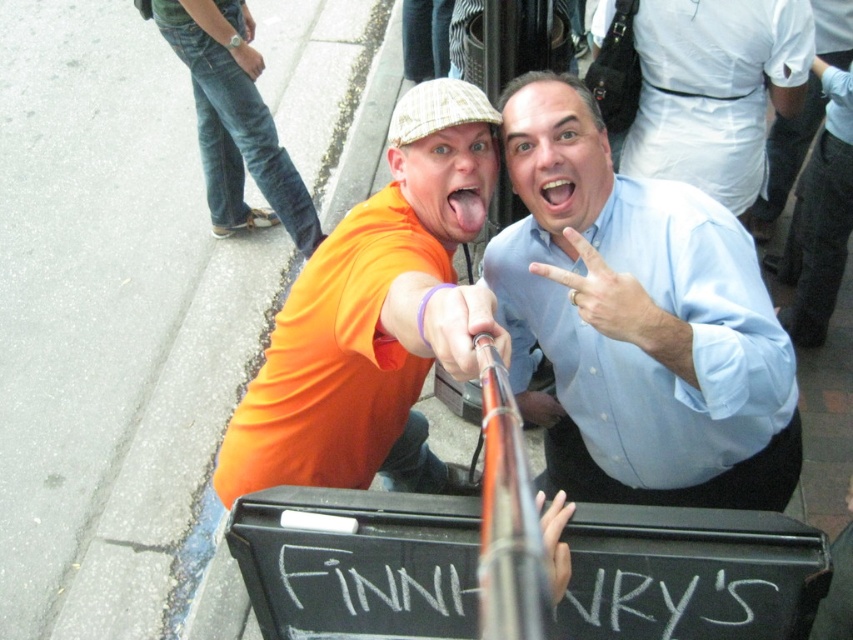
You are a photographer trying to capture a candid shot of the two people in the scene. You notice the smooth pink tongue at center and the white matte hand at upper center. Which object is positioned lower in the image?

The smooth pink tongue at center is positioned below the white matte hand at upper center, so it is lower in the image.

You are a photographer trying to capture a detailed shot of both the white matte hand at center and the white matte hand at upper center. Which hand should you focus on first to ensure it appears sharp in the photo?

You should focus on the white matte hand at center first because it is closer to the viewer, making it easier to achieve sharpness before adjusting focus for the hand at upper center.